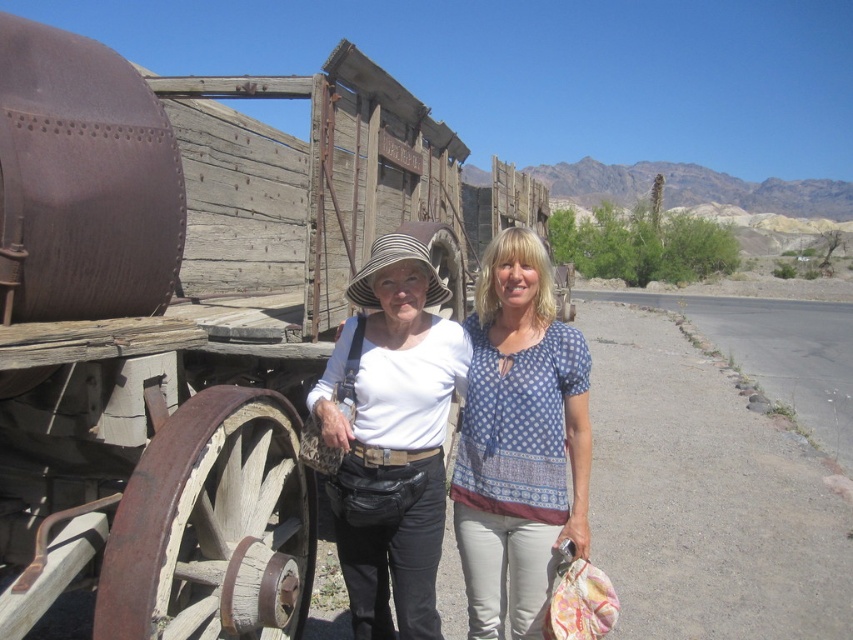
Question: Which object is positioned farthest from the white fabric blouse at center?

Choices:
 (A) blue dotted blouse at center
 (B) rusty wood wagon at center
 (C) striped fabric cowboy hat at center

Answer: (B)

Question: Based on their relative distances, which object is farther from the rusty wood wagon at center?

Choices:
 (A) white fabric blouse at center
 (B) blue dotted blouse at center

Answer: (B)

Question: Is rusty wood wagon at center smaller than white fabric blouse at center?

Choices:
 (A) yes
 (B) no

Answer: (A)

Question: Which point appears farthest from the camera in this image?

Choices:
 (A) 387,240
 (B) 585,554
 (C) 86,240

Answer: (A)

Question: Considering the relative positions of white fabric blouse at center and striped fabric cowboy hat at center in the image provided, where is white fabric blouse at center located with respect to striped fabric cowboy hat at center?

Choices:
 (A) left
 (B) right

Answer: (A)

Question: Can you confirm if rusty wood wagon at center is smaller than blue dotted blouse at center?

Choices:
 (A) yes
 (B) no

Answer: (A)